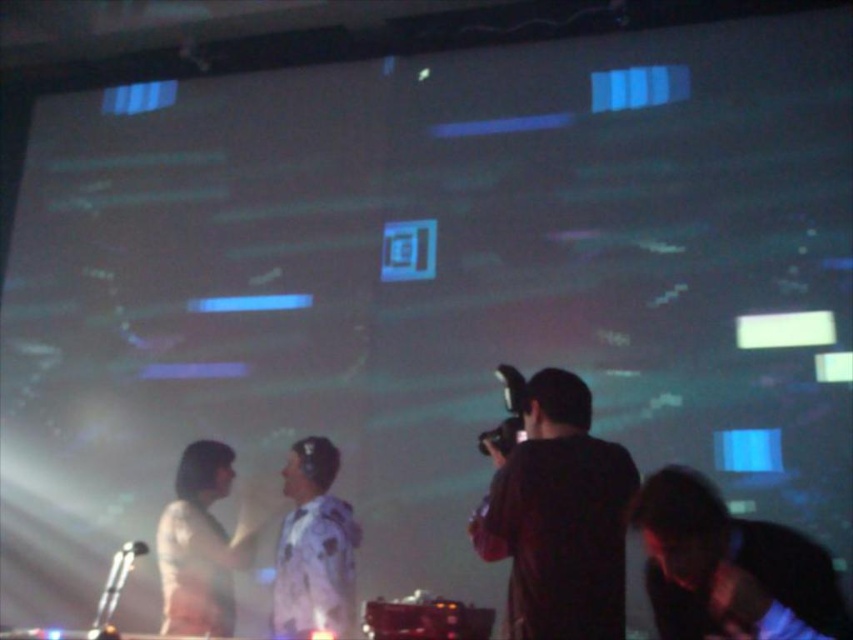
You are a photographer standing at the front of the stage, holding a camera. You want to capture a close shot of the performers in the foreground without the large screen in the background. The black matte camera at lower right has a focal length of 50mm. Would using this camera allow you to achieve your goal?

The black matte camera at lower right is 1.83 meters away from the viewer. With a 50mm focal length, this distance allows for a close shot of the performers while keeping the large screen out of frame.

You are a photographer at the event and want to capture a photo of the white matte shirt at center without the black matte camera at lower right appearing in the frame. Is this possible based on their positions?

The black matte camera at lower right is above the white matte shirt at center, so adjusting the camera angle downward might allow capturing the white matte shirt at center without the black matte camera at lower right obstructing the view.

You are a photographer at a live event. You want to capture a photo of the performers and the large screen behind them. The camera you have is located at point (728, 564). Is this camera position suitable for framing both the performers and the screen in your shot?

The black matte camera at lower right is represented by point (728, 564). This position might be suitable as it is placed at the lower right, allowing the photographer to frame both the performers in the foreground and the large screen behind them in the shot. However, the exact framing would depend on the camera lens and angle adjustments.